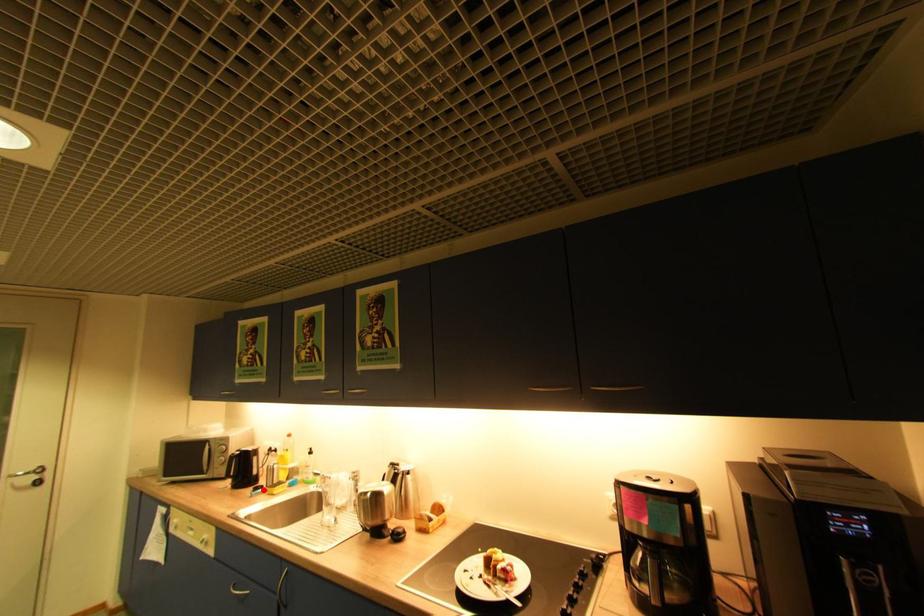
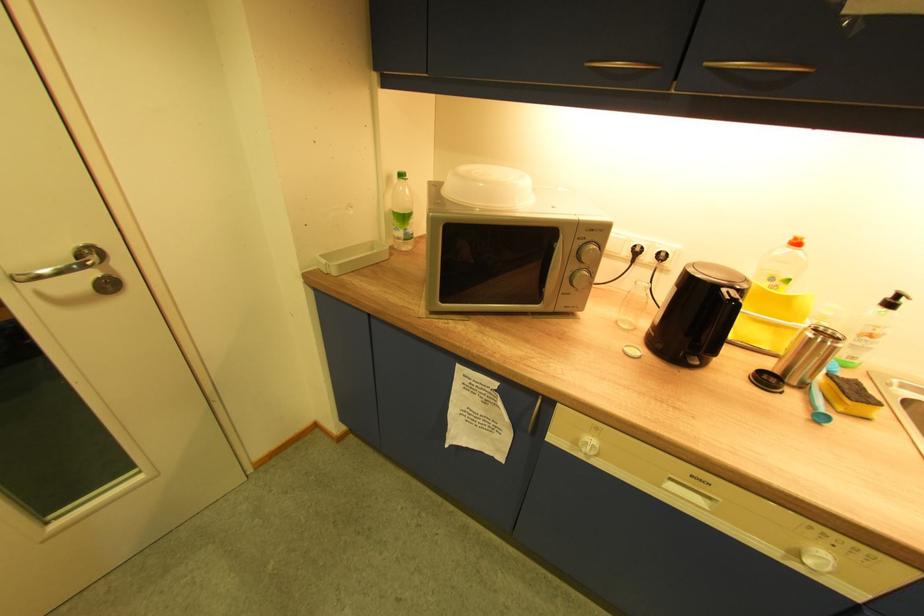
The point at the highlighted location is marked in the first image. Where is the corresponding point in the second image?

(772, 382)